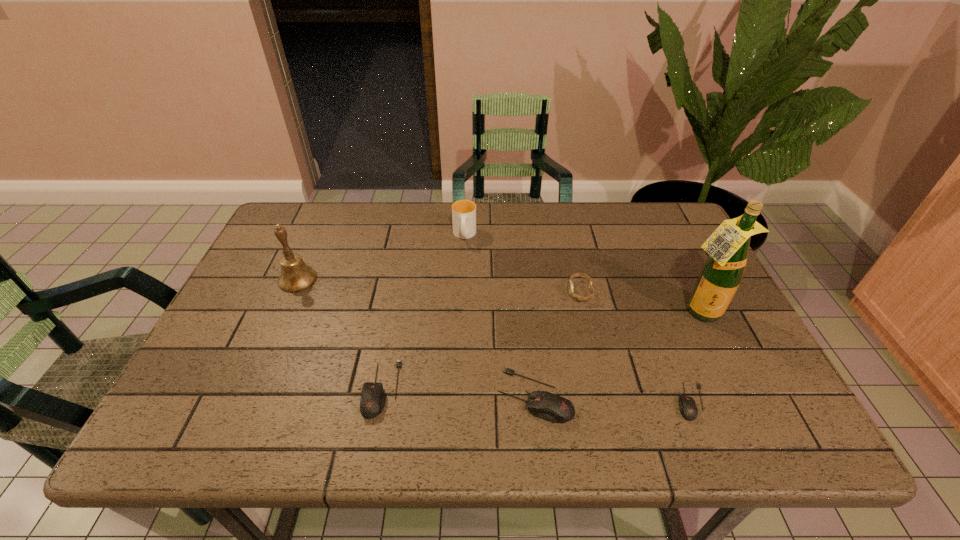
Where is `the leftmost mouse`? The width and height of the screenshot is (960, 540). the leftmost mouse is located at coordinates (373, 398).

The height and width of the screenshot is (540, 960). I want to click on the second shortest mouse, so click(373, 398).

Identify the location of the second mouse from left to right. (548, 406).

Identify the location of the shortest object. The height and width of the screenshot is (540, 960). 688,409.

Locate an element on the screen. the shortest mouse is located at coordinates (688, 409).

Locate an element on the screen. the farthest object is located at coordinates (463, 211).

Where is `the third tallest object`? Image resolution: width=960 pixels, height=540 pixels. the third tallest object is located at coordinates (463, 211).

The image size is (960, 540). In order to click on the rightmost object in this screenshot , I will do `click(722, 273)`.

Where is `liquor`? The width and height of the screenshot is (960, 540). liquor is located at coordinates (722, 273).

Identify the location of the sixth shortest object. (296, 276).